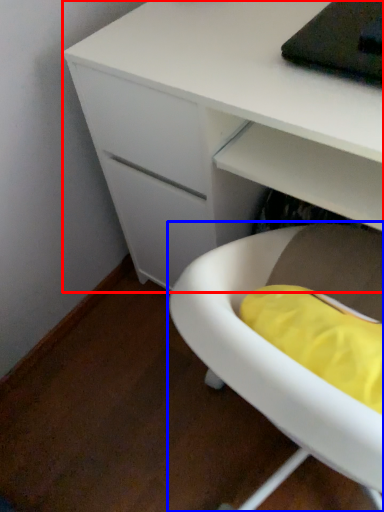
Question: Which object is further to the camera taking this photo, desk (highlighted by a red box) or furniture (highlighted by a blue box)?

Choices:
 (A) desk
 (B) furniture

Answer: (A)